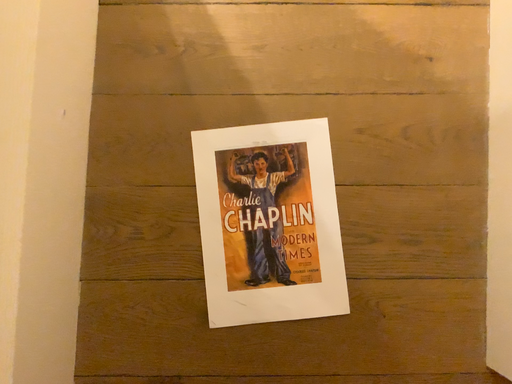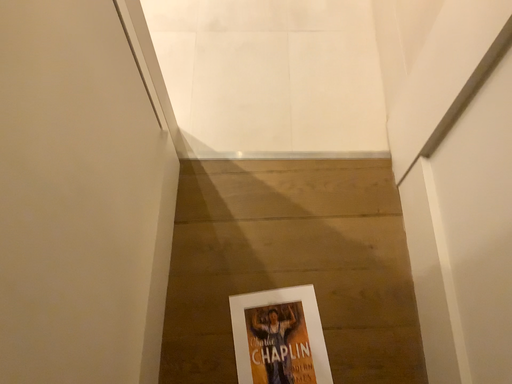
Question: How did the camera likely rotate when shooting the video?

Choices:
 (A) rotated downward
 (B) rotated upward

Answer: (B)